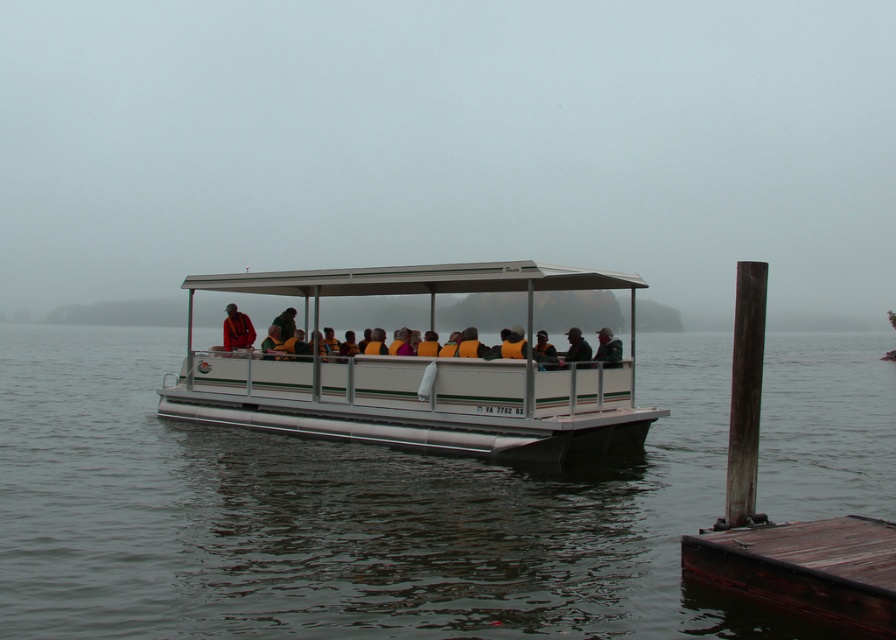
Does dark brown wooden dock at lower right have a lesser height compared to dark gray fabric jacket at center?

Yes.

Does point (815, 573) lie in front of point (597, 333)?

That is True.

Find the location of a particular element. This screenshot has height=640, width=896. dark brown wooden dock at lower right is located at coordinates (806, 568).

Is point (610, 358) farther from camera compared to point (570, 339)?

No.

Who is more forward, (619,353) or (578,349)?

Point (578,349)

Image resolution: width=896 pixels, height=640 pixels. What do you see at coordinates (608, 348) in the screenshot? I see `dark gray fabric jacket at center` at bounding box center [608, 348].

Locate an element on the screen. The image size is (896, 640). dark gray fabric jacket at center is located at coordinates (608, 348).

Is point (727, 540) less distant than point (584, 340)?

Yes, it is.

Who is shorter, dark brown wooden dock at lower right or dark green jacket at center?

With less height is dark brown wooden dock at lower right.

I want to click on dark brown wooden dock at lower right, so click(806, 568).